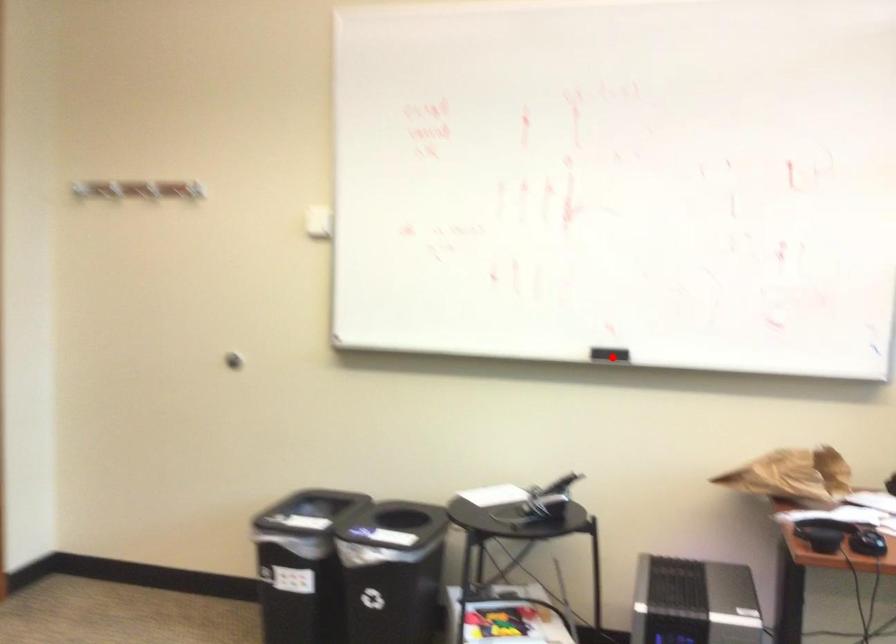
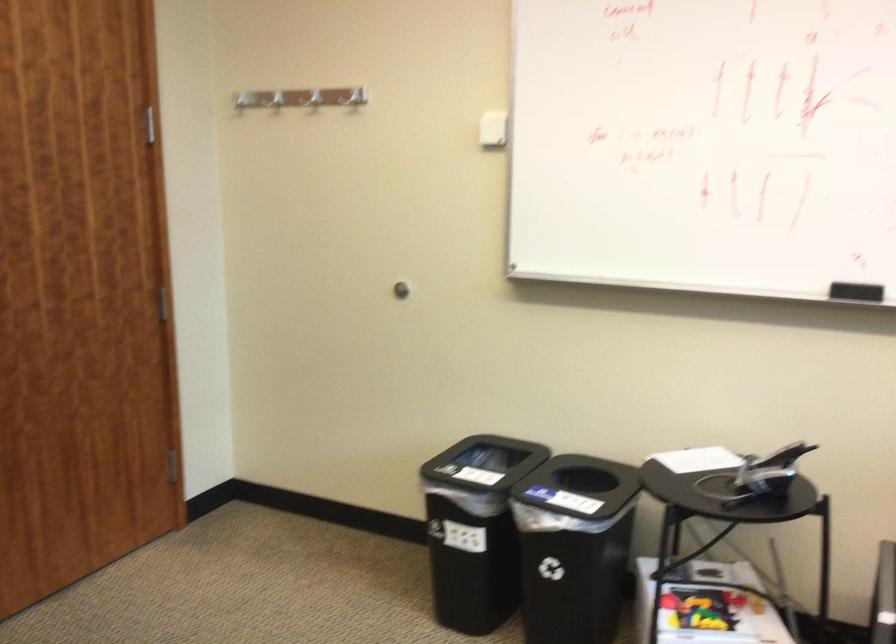
Question: A red point is marked in image1. In image2, is the corresponding 3D point closer to the camera or farther? Reply with the corresponding letter.

Choices:
 (A) The corresponding 3D point is closer.
 (B) The corresponding 3D point is farther.

Answer: (A)